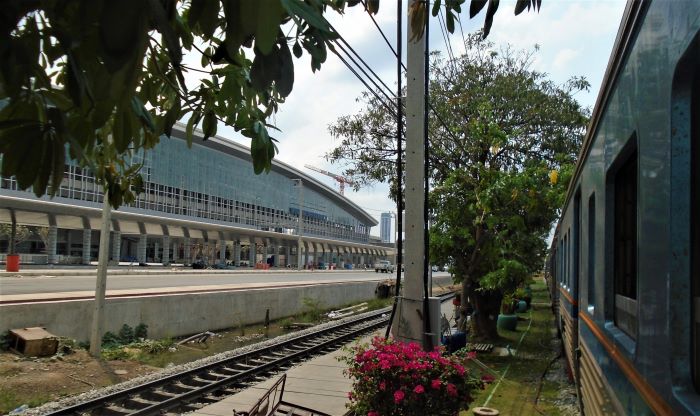
At what (x,y) coordinates should I click in order to perform the action: click on wall. Please return your answer as a coordinate pair (x, y). The width and height of the screenshot is (700, 416). Looking at the image, I should click on (642, 104).